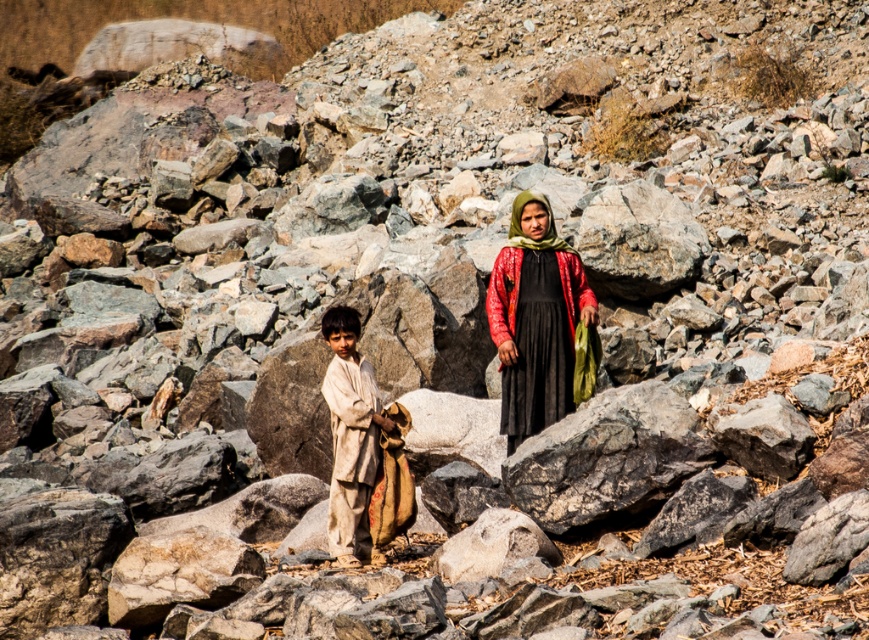
You are standing in the rocky terrain and need to place a flag at the point that is closer to you. Which point should you choose between point (x=372, y=387) and point (x=516, y=211)?

You should choose point (x=372, y=387) because it is closer to the viewer than point (x=516, y=211).

You are a tailor in the scene and need to decide which fabric to use for a wide sleeve design. Based on the red textured fabric at center and the green textured shawl at center, which one is wider?

The red textured fabric at center is wider than the green textured shawl at center, so it would be suitable for a wide sleeve design.

You are a photographer standing in front of the red textured fabric at center. You want to capture a photo that includes both the fabric and the woman in the black dress with a red patterned shawl. Can you fit both subjects in the frame without moving your position?

The red textured fabric at center is 18.35 meters from viewer, so the woman in the black dress with a red patterned shawl is closer to you than the fabric. Since both subjects are at different distances, you can likely fit both in the frame by adjusting the camera angle or zoom level to include both the foreground and background elements.